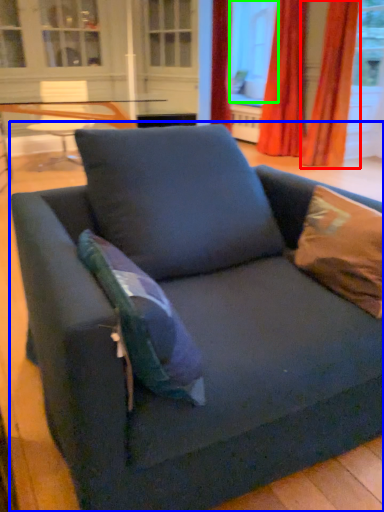
Question: Considering the real-world distances, which object is farthest from curtain (highlighted by a red box)? studio couch (highlighted by a blue box) or window screen (highlighted by a green box)?

Choices:
 (A) studio couch
 (B) window screen

Answer: (A)